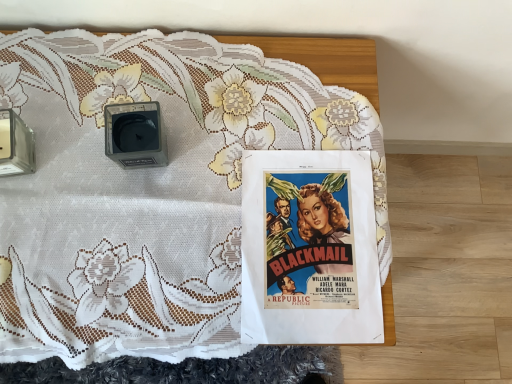
Question: Is vivid paper poster at center inside the boundaries of white lace tablecloth at center, or outside?

Choices:
 (A) inside
 (B) outside

Answer: (A)

Question: In the image, is vivid paper poster at center positioned in front of or behind white lace tablecloth at center?

Choices:
 (A) behind
 (B) front

Answer: (A)

Question: Estimate the real-world distances between objects in this image. Which object is farther from the matte black alarm clock at upper left?

Choices:
 (A) white lace tablecloth at center
 (B) vivid paper poster at center

Answer: (B)

Question: Which of these objects is positioned closest to the white lace tablecloth at center?

Choices:
 (A) vivid paper poster at center
 (B) matte black alarm clock at upper left

Answer: (A)